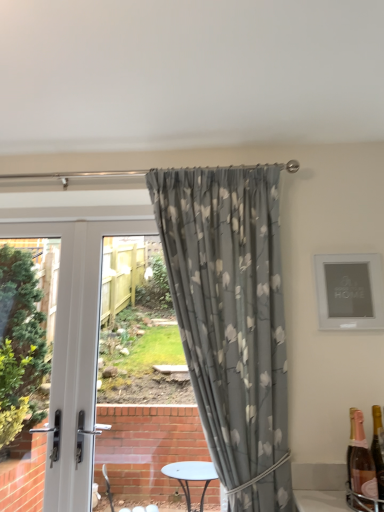
The image size is (384, 512). What do you see at coordinates (378, 448) in the screenshot?
I see `pink glass bottle at lower right, placed as the 2th bottle when sorted from left to right` at bounding box center [378, 448].

Locate an element on the screen. The width and height of the screenshot is (384, 512). pink glass bottle at lower right, placed as the 1th bottle when sorted from right to left is located at coordinates (378, 448).

This screenshot has width=384, height=512. What do you see at coordinates (349, 291) in the screenshot? I see `matte silver picture frame at upper right` at bounding box center [349, 291].

In order to click on white glossy door at left in this screenshot , I will do `click(75, 347)`.

This screenshot has height=512, width=384. What are the coordinates of `pink glass bottle at lower right, placed as the 1th bottle when sorted from right to left` in the screenshot? It's located at pos(378,448).

Which object is thinner, gold metallic bottle at lower right, acting as the first bottle starting from the front, or white glossy door at left?

With smaller width is white glossy door at left.

Which is more to the left, gold metallic bottle at lower right, the 1th bottle positioned from the left, or white glossy door at left?

white glossy door at left.

Locate an element on the screen. door that appears above the gold metallic bottle at lower right, the 2th bottle when ordered from right to left (from a real-world perspective) is located at coordinates (75, 347).

Would you say gold metallic bottle at lower right, acting as the first bottle starting from the front, is inside or outside white glossy door at left?

gold metallic bottle at lower right, acting as the first bottle starting from the front, is not inside white glossy door at left, it's outside.

Based on their positions, is pink glass bottle at lower right, which is counted as the 1th bottle, starting from the back, located to the left or right of gold metallic bottle at lower right, the 2th bottle when ordered from right to left?

Clearly, pink glass bottle at lower right, which is counted as the 1th bottle, starting from the back, is on the right of gold metallic bottle at lower right, the 2th bottle when ordered from right to left, in the image.

From the image's perspective, would you say pink glass bottle at lower right, placed as the 2th bottle when sorted from left to right, is shown under gold metallic bottle at lower right, which is counted as the 2th bottle, starting from the back?

Yes, from the image's perspective, pink glass bottle at lower right, placed as the 2th bottle when sorted from left to right, is below gold metallic bottle at lower right, which is counted as the 2th bottle, starting from the back.

Find the location of `bottle on the right of gold metallic bottle at lower right, which is counted as the 2th bottle, starting from the back`. bottle on the right of gold metallic bottle at lower right, which is counted as the 2th bottle, starting from the back is located at coordinates (378, 448).

From the picture: Considering the sizes of gray floral fabric curtain at center and white glossy door at left in the image, is gray floral fabric curtain at center bigger or smaller than white glossy door at left?

In the image, gray floral fabric curtain at center appears to be larger than white glossy door at left.

How many degrees apart are the facing directions of gray floral fabric curtain at center and white glossy door at left?

The facing directions of gray floral fabric curtain at center and white glossy door at left are 0.00209 degrees apart.

From the image's perspective, is gray floral fabric curtain at center positioned above or below white glossy door at left?

From the image's perspective, gray floral fabric curtain at center appears above white glossy door at left.

Can you confirm if pink glass bottle at lower right, which ranks as the 2th bottle in front-to-back order, is wider than white glossy door at left?

No, pink glass bottle at lower right, which ranks as the 2th bottle in front-to-back order, is not wider than white glossy door at left.

Locate an element on the screen. door lying on the left of pink glass bottle at lower right, placed as the 2th bottle when sorted from left to right is located at coordinates (75, 347).

Considering the sizes of objects pink glass bottle at lower right, placed as the 2th bottle when sorted from left to right, and white glossy door at left in the image provided, who is bigger, pink glass bottle at lower right, placed as the 2th bottle when sorted from left to right, or white glossy door at left?

white glossy door at left.

The height and width of the screenshot is (512, 384). There is a white glossy door at left. In order to click on picture frame above it (from a real-world perspective) in this screenshot , I will do click(x=349, y=291).

Is matte silver picture frame at upper right directly adjacent to white glossy door at left?

matte silver picture frame at upper right and white glossy door at left are clearly separated.

Does point (379, 313) come closer to viewer compared to point (79, 252)?

Yes, it is in front of point (79, 252).

From the image's perspective, which object appears higher, matte silver picture frame at upper right or white glossy door at left?

matte silver picture frame at upper right.

Considering the sizes of objects matte silver picture frame at upper right and gray floral fabric curtain at center in the image provided, who is bigger, matte silver picture frame at upper right or gray floral fabric curtain at center?

gray floral fabric curtain at center is bigger.

Does matte silver picture frame at upper right turn towards gray floral fabric curtain at center?

No, matte silver picture frame at upper right is not facing towards gray floral fabric curtain at center.

Are matte silver picture frame at upper right and gray floral fabric curtain at center far apart?

No, matte silver picture frame at upper right is not far away from gray floral fabric curtain at center.

Considering the positions of point (357, 294) and point (266, 385), is point (357, 294) closer or farther from the camera than point (266, 385)?

Point (357, 294) is positioned farther from the camera compared to point (266, 385).

Who is taller, matte silver picture frame at upper right or gold metallic bottle at lower right, acting as the first bottle starting from the front?

matte silver picture frame at upper right is taller.

From the image's perspective, which bottle is the 1st one below the matte silver picture frame at upper right? Please provide its 2D coordinates.

[(361, 468)]

Is matte silver picture frame at upper right far away from gold metallic bottle at lower right, acting as the first bottle starting from the front?

Actually, matte silver picture frame at upper right and gold metallic bottle at lower right, acting as the first bottle starting from the front, are a little close together.

Which of these two, matte silver picture frame at upper right or gold metallic bottle at lower right, the 2th bottle when ordered from right to left, is wider?

Wider between the two is gold metallic bottle at lower right, the 2th bottle when ordered from right to left.

I want to click on the 1st bottle positioned below the white glossy door at left (from the image's perspective), so click(x=361, y=468).

Find the location of `bottle below the pink glass bottle at lower right, which is counted as the 1th bottle, starting from the back (from a real-world perspective)`. bottle below the pink glass bottle at lower right, which is counted as the 1th bottle, starting from the back (from a real-world perspective) is located at coordinates (361, 468).

When comparing their distances from pink glass bottle at lower right, placed as the 1th bottle when sorted from right to left, does gray floral fabric curtain at center or matte silver picture frame at upper right seem further?

gray floral fabric curtain at center is positioned further to the anchor pink glass bottle at lower right, placed as the 1th bottle when sorted from right to left.

From the picture: Looking at the image, which one is located further to white glossy door at left, pink glass bottle at lower right, which ranks as the 2th bottle in front-to-back order, or gray floral fabric curtain at center?

pink glass bottle at lower right, which ranks as the 2th bottle in front-to-back order, is further to white glossy door at left.

When comparing their distances from gray floral fabric curtain at center, does pink glass bottle at lower right, which ranks as the 2th bottle in front-to-back order, or matte silver picture frame at upper right seem further?

pink glass bottle at lower right, which ranks as the 2th bottle in front-to-back order, is positioned further to the anchor gray floral fabric curtain at center.

From the image, which object appears to be nearer to gray floral fabric curtain at center, pink glass bottle at lower right, placed as the 1th bottle when sorted from right to left, or white glossy door at left?

The object closer to gray floral fabric curtain at center is white glossy door at left.

In the scene shown: Looking at the image, which one is located closer to matte silver picture frame at upper right, pink glass bottle at lower right, placed as the 2th bottle when sorted from left to right, or gold metallic bottle at lower right, the 1th bottle positioned from the left?

pink glass bottle at lower right, placed as the 2th bottle when sorted from left to right.

Estimate the real-world distances between objects in this image. Which object is closer to gold metallic bottle at lower right, the 1th bottle positioned from the left, matte silver picture frame at upper right or pink glass bottle at lower right, which ranks as the 2th bottle in front-to-back order?

The object closer to gold metallic bottle at lower right, the 1th bottle positioned from the left, is pink glass bottle at lower right, which ranks as the 2th bottle in front-to-back order.

Based on their spatial positions, is gray floral fabric curtain at center or matte silver picture frame at upper right closer to white glossy door at left?

Based on the image, gray floral fabric curtain at center appears to be nearer to white glossy door at left.

Which object lies further to the anchor point pink glass bottle at lower right, which ranks as the 2th bottle in front-to-back order, white glossy door at left or matte silver picture frame at upper right?

The object further to pink glass bottle at lower right, which ranks as the 2th bottle in front-to-back order, is white glossy door at left.

Where is `curtain between white glossy door at left and matte silver picture frame at upper right from left to right`? The height and width of the screenshot is (512, 384). curtain between white glossy door at left and matte silver picture frame at upper right from left to right is located at coordinates (231, 320).

What are the coordinates of `bottle between white glossy door at left and matte silver picture frame at upper right from left to right` in the screenshot? It's located at (361, 468).

The height and width of the screenshot is (512, 384). Find the location of `picture frame between white glossy door at left and pink glass bottle at lower right, placed as the 1th bottle when sorted from right to left, in the horizontal direction`. picture frame between white glossy door at left and pink glass bottle at lower right, placed as the 1th bottle when sorted from right to left, in the horizontal direction is located at coordinates (349, 291).

In order to click on bottle located between gray floral fabric curtain at center and matte silver picture frame at upper right in the left-right direction in this screenshot , I will do `click(361, 468)`.